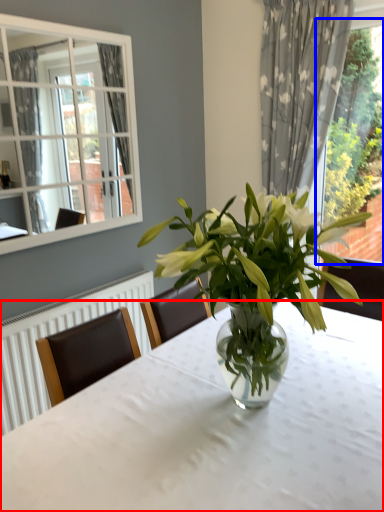
Question: Among these objects, which one is nearest to the camera, table (highlighted by a red box) or bay window (highlighted by a blue box)?

Choices:
 (A) table
 (B) bay window

Answer: (A)